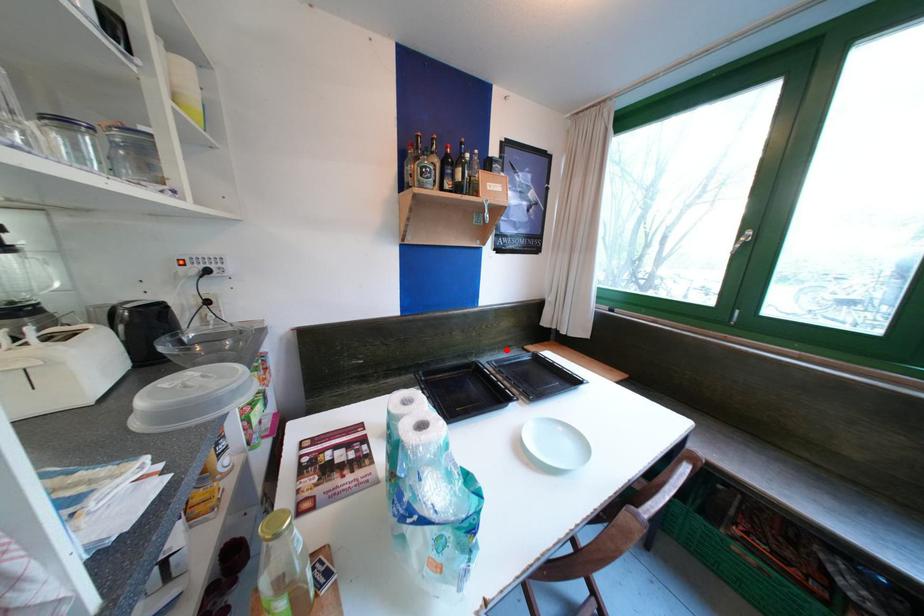
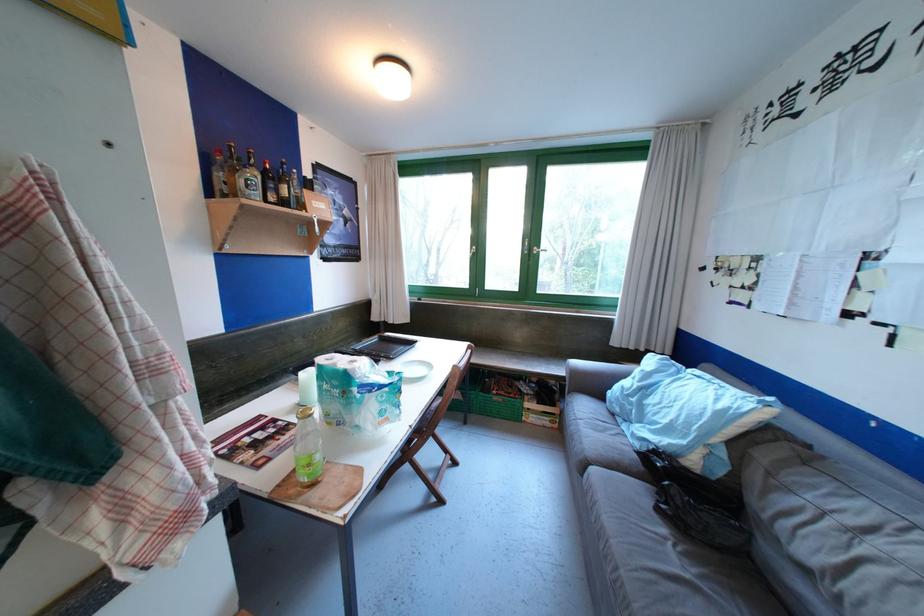
In the second image, find the point that corresponds to the highlighted location in the first image.

(348, 349)